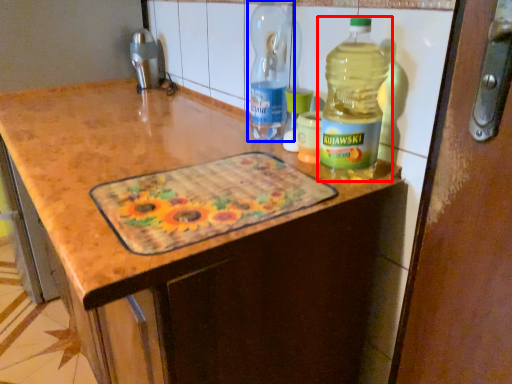
Question: Which of the following is the farthest to the observer, bottle (highlighted by a red box) or bottle (highlighted by a blue box)?

Choices:
 (A) bottle
 (B) bottle

Answer: (B)